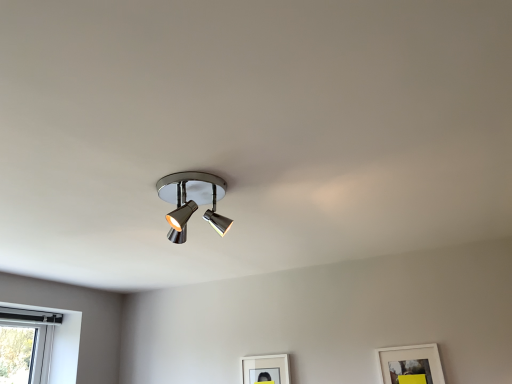
Question: Can you confirm if polished chrome spotlight at center is smaller than matte white picture frame at lower center, which is the first picture frame from left to right?

Choices:
 (A) no
 (B) yes

Answer: (A)

Question: Does polished chrome spotlight at center have a greater height compared to matte white picture frame at lower center, the 1th picture frame in the back-to-front sequence?

Choices:
 (A) yes
 (B) no

Answer: (B)

Question: Is polished chrome spotlight at center oriented away from matte white picture frame at lower center, the second picture frame in the front-to-back sequence?

Choices:
 (A) no
 (B) yes

Answer: (A)

Question: Is polished chrome spotlight at center wider than matte white picture frame at lower center, the second picture frame in the front-to-back sequence?

Choices:
 (A) no
 (B) yes

Answer: (B)

Question: Does polished chrome spotlight at center have a lesser height compared to matte white picture frame at lower center, the 1th picture frame in the back-to-front sequence?

Choices:
 (A) no
 (B) yes

Answer: (B)

Question: Are polished chrome spotlight at center and matte white picture frame at lower center, the second picture frame in the front-to-back sequence, located far from each other?

Choices:
 (A) no
 (B) yes

Answer: (B)

Question: Is white matte picture frame at lower right, marked as the 2th picture frame in a back-to-front arrangement, bigger than polished chrome spotlight at center?

Choices:
 (A) yes
 (B) no

Answer: (B)

Question: Does white matte picture frame at lower right, the first picture frame positioned from the front, have a lesser height compared to polished chrome spotlight at center?

Choices:
 (A) no
 (B) yes

Answer: (A)

Question: Can you confirm if white matte picture frame at lower right, marked as the 2th picture frame in a back-to-front arrangement, is smaller than polished chrome spotlight at center?

Choices:
 (A) yes
 (B) no

Answer: (A)

Question: Is white matte picture frame at lower right, the first picture frame positioned from the front, outside polished chrome spotlight at center?

Choices:
 (A) no
 (B) yes

Answer: (B)

Question: Is the surface of white matte picture frame at lower right, which is the second picture frame from left to right, in direct contact with polished chrome spotlight at center?

Choices:
 (A) no
 (B) yes

Answer: (A)

Question: Is white matte picture frame at lower right, marked as the 2th picture frame in a back-to-front arrangement, to the left of polished chrome spotlight at center from the viewer's perspective?

Choices:
 (A) yes
 (B) no

Answer: (B)

Question: Are white matte picture frame at lower right, which is the second picture frame from left to right, and matte white picture frame at lower center, the second picture frame in the front-to-back sequence, far apart?

Choices:
 (A) yes
 (B) no

Answer: (B)